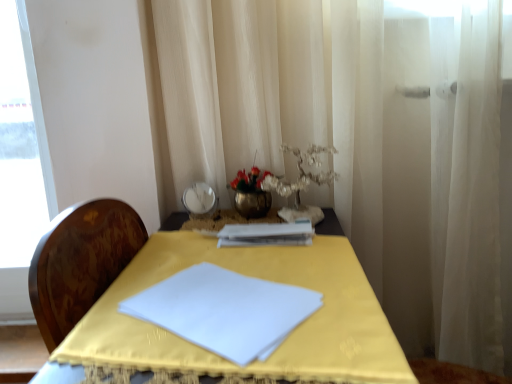
Measure the distance between yellow fabric table at center and camera.

yellow fabric table at center is 20.85 inches from camera.

Locate an element on the screen. white sheer curtain at right is located at coordinates (456, 187).

Would you consider matte silver bowl at upper center to be distant from white sheer curtain at right?

Actually, matte silver bowl at upper center and white sheer curtain at right are a little close together.

Does point (196, 190) lie in front of point (416, 21)?

No.

Is matte silver bowl at upper center further to camera compared to white sheer curtain at right?

Yes, matte silver bowl at upper center is behind white sheer curtain at right.

Is matte silver bowl at upper center bigger than white sheer curtain at right?

No.

Can you confirm if matte silver bowl at upper center is wider than metallic vase at center?

No.

Can you confirm if matte silver bowl at upper center is shorter than metallic vase at center?

Yes.

Is point (205, 196) behind point (252, 206)?

Yes, point (205, 196) is farther from viewer.

Is metallic vase at center a part of matte silver bowl at upper center?

That's incorrect, metallic vase at center is not inside matte silver bowl at upper center.

Is metallic vase at center to the right of white sheer curtain at right from the viewer's perspective?

Incorrect, metallic vase at center is not on the right side of white sheer curtain at right.

Does metallic vase at center have a greater height compared to white sheer curtain at right?

Incorrect, the height of metallic vase at center is not larger of that of white sheer curtain at right.

Is metallic vase at center facing away from white sheer curtain at right?

That's not correct — metallic vase at center is not looking away from white sheer curtain at right.

Which is farther from the camera, (243, 180) or (438, 329)?

The point (438, 329) is farther from the camera.

Is yellow fabric table at center not inside matte silver bowl at upper center?

Yes, yellow fabric table at center is located beyond the bounds of matte silver bowl at upper center.

Is yellow fabric table at center oriented away from matte silver bowl at upper center?

That's not correct — yellow fabric table at center is not looking away from matte silver bowl at upper center.

From a real-world perspective, is yellow fabric table at center physically located above or below matte silver bowl at upper center?

From a real-world perspective, yellow fabric table at center is physically below matte silver bowl at upper center.

Would you say yellow fabric table at center is a long distance from matte silver bowl at upper center?

That's not correct — yellow fabric table at center is a little close to matte silver bowl at upper center.

Which object is wider, white paper journal at center or yellow fabric table at center?

With larger width is yellow fabric table at center.

Considering the sizes of objects white paper journal at center and yellow fabric table at center in the image provided, who is bigger, white paper journal at center or yellow fabric table at center?

Bigger between the two is yellow fabric table at center.

Is white paper journal at center completely or partially outside of yellow fabric table at center?

No, white paper journal at center is inside yellow fabric table at center's boundary.

How many degrees apart are the facing directions of metallic vase at center and matte silver bowl at upper center?

The facing directions of metallic vase at center and matte silver bowl at upper center are 1.73 degrees apart.

From a real-world perspective, who is located higher, metallic vase at center or matte silver bowl at upper center?

metallic vase at center.

Considering the relative positions of metallic vase at center and matte silver bowl at upper center in the image provided, is metallic vase at center to the right of matte silver bowl at upper center from the viewer's perspective?

Yes, metallic vase at center is to the right of matte silver bowl at upper center.

Does metallic vase at center turn towards matte silver bowl at upper center?

No, metallic vase at center is not turned towards matte silver bowl at upper center.

From the image's perspective, which is below, yellow fabric table at center or metallic vase at center?

yellow fabric table at center.

In terms of size, does yellow fabric table at center appear bigger or smaller than metallic vase at center?

Considering their sizes, yellow fabric table at center takes up more space than metallic vase at center.

Is yellow fabric table at center not close to metallic vase at center?

That's not correct — yellow fabric table at center is a little close to metallic vase at center.

From a real-world perspective, is yellow fabric table at center above or below metallic vase at center?

yellow fabric table at center is situated lower than metallic vase at center in the real world.

Find the location of a particular element. This screenshot has height=384, width=512. curtain in front of the matte silver bowl at upper center is located at coordinates (456, 187).

Identify the location of tableware located underneath the metallic vase at center (from a real-world perspective). The height and width of the screenshot is (384, 512). (200, 200).

Considering their positions, is metallic vase at center positioned closer to matte silver bowl at upper center than white sheer curtain at right?

The object closer to matte silver bowl at upper center is metallic vase at center.

Which object lies further to the anchor point yellow fabric table at center, white sheer curtain at right or white paper journal at center?

Based on the image, white sheer curtain at right appears to be further to yellow fabric table at center.

Looking at this image, estimate the real-world distances between objects in this image. Which object is further from white sheer curtain at right, metallic vase at center or yellow fabric table at center?

yellow fabric table at center is positioned further to the anchor white sheer curtain at right.

From the picture: Estimate the real-world distances between objects in this image. Which object is further from metallic vase at center, matte silver bowl at upper center or white sheer curtain at right?

white sheer curtain at right is positioned further to the anchor metallic vase at center.

Which object lies nearer to the anchor point yellow fabric table at center, matte silver bowl at upper center or metallic vase at center?

The object closer to yellow fabric table at center is metallic vase at center.

When comparing their distances from metallic vase at center, does yellow fabric table at center or white paper journal at center seem further?

yellow fabric table at center lies further to metallic vase at center than the other object.

From the image, which object appears to be farther from yellow fabric table at center, white sheer curtain at right or matte silver bowl at upper center?

white sheer curtain at right is further to yellow fabric table at center.

From the image, which object appears to be farther from white sheer curtain at right, matte silver bowl at upper center or yellow fabric table at center?

matte silver bowl at upper center.

You are a GUI agent. You are given a task and a screenshot of the screen. Output one action in this format:
    pyautogui.click(x=<x>, y=<y>)
    Task: Click on the journal between yellow fabric table at center and matte silver bowl at upper center in the front-back direction
    
    Given the screenshot: What is the action you would take?
    pyautogui.click(x=266, y=234)

The width and height of the screenshot is (512, 384). Identify the location of curtain positioned between yellow fabric table at center and matte silver bowl at upper center from near to far. (456, 187).

Locate an element on the screen. curtain between yellow fabric table at center and metallic vase at center along the z-axis is located at coordinates (456, 187).

The image size is (512, 384). Identify the location of floral arrangement between yellow fabric table at center and matte silver bowl at upper center along the z-axis. (251, 193).